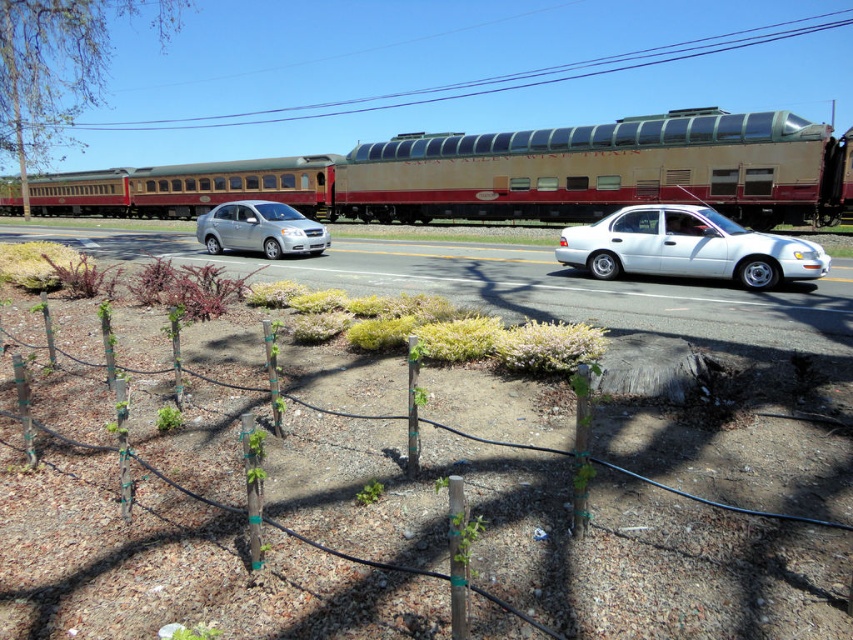
Who is shorter, metallic gold train at center or white glossy sedan at right?

white glossy sedan at right is shorter.

Is metallic gold train at center behind white glossy sedan at right?

Yes, metallic gold train at center is further from the viewer.

Who is more distant from viewer, (730, 182) or (785, 241)?

The point (730, 182) is more distant.

This screenshot has width=853, height=640. Find the location of `metallic gold train at center`. metallic gold train at center is located at coordinates (515, 173).

Is green wood fence at lower center behind green leafy tree at upper left?

No.

Which is above, green wood fence at lower center or green leafy tree at upper left?

green leafy tree at upper left

Which is in front, point (4, 532) or point (47, 90)?

Point (4, 532) is in front.

Where is `green wood fence at lower center`? Image resolution: width=853 pixels, height=640 pixels. green wood fence at lower center is located at coordinates (560, 536).

Who is more distant from viewer, [352,554] or [321,234]?

Positioned behind is point [321,234].

Who is more forward, (x=601, y=480) or (x=265, y=209)?

Positioned in front is point (x=601, y=480).

At what (x,y) coordinates should I click in order to perform the action: click on green wood fence at lower center. Please return your answer as a coordinate pair (x, y). Looking at the image, I should click on (560, 536).

You are a GUI agent. You are given a task and a screenshot of the screen. Output one action in this format:
    pyautogui.click(x=<x>, y=<y>)
    Task: Click on the green wood fence at lower center
    
    Given the screenshot: What is the action you would take?
    pyautogui.click(x=560, y=536)